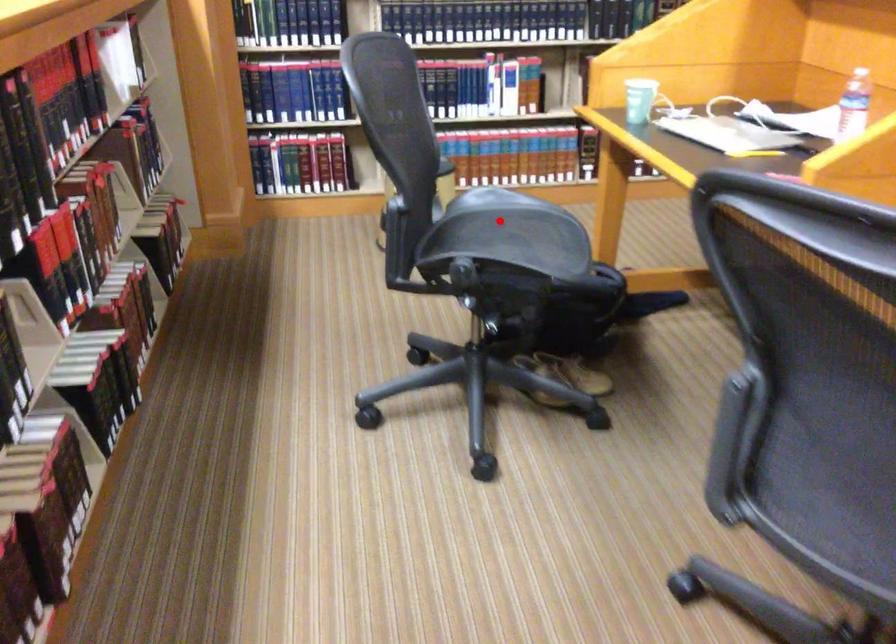
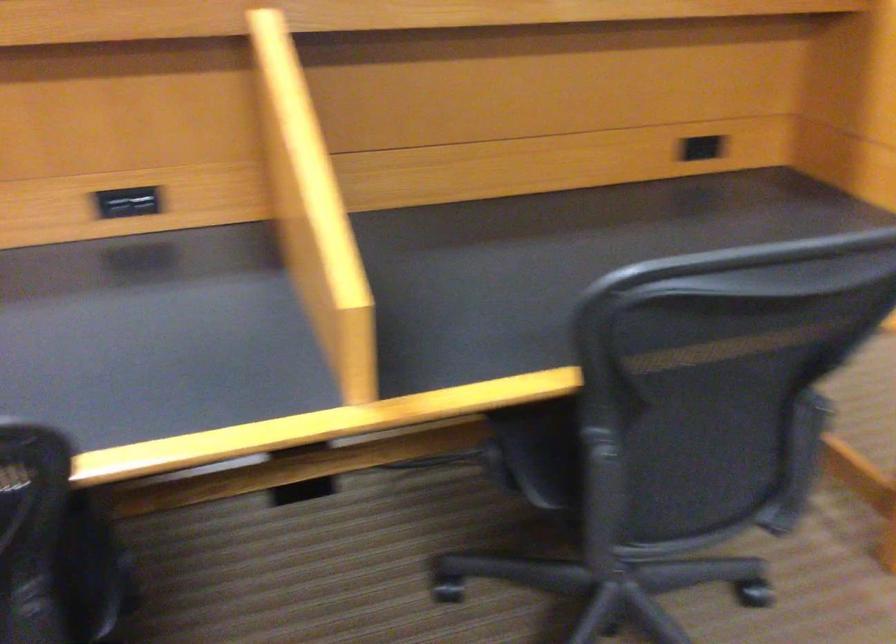
Question: I am providing you with two images of the same scene from different viewpoints. A red point is marked on the first image. Is the red point's position out of view in image 2?

Choices:
 (A) Yes
 (B) No

Answer: (A)